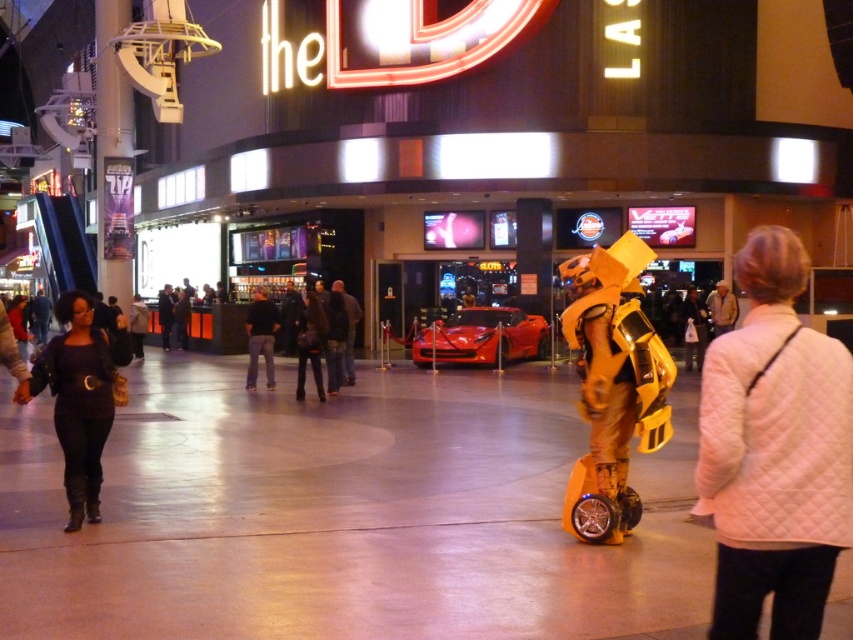
Question: Is the position of white quilted jacket at lower right more distant than that of shiny red car at center?

Choices:
 (A) yes
 (B) no

Answer: (B)

Question: Estimate the real-world distances between objects in this image. Which object is closer to the black leather jacket at left?

Choices:
 (A) shiny red car at center
 (B) black leather pants at center

Answer: (B)

Question: Can you confirm if yellow matte scooter at center is thinner than black leather jacket at center?

Choices:
 (A) yes
 (B) no

Answer: (A)

Question: Does yellow matte scooter at center appear on the right side of black leather jacket at left?

Choices:
 (A) no
 (B) yes

Answer: (B)

Question: Based on their relative distances, which object is nearer to the yellow matte scooter at center?

Choices:
 (A) black leather pants at center
 (B) shiny red car at center

Answer: (A)

Question: Which of these objects is positioned farthest from the black leather pants at center?

Choices:
 (A) white quilted jacket at lower right
 (B) yellow matte scooter at center

Answer: (A)